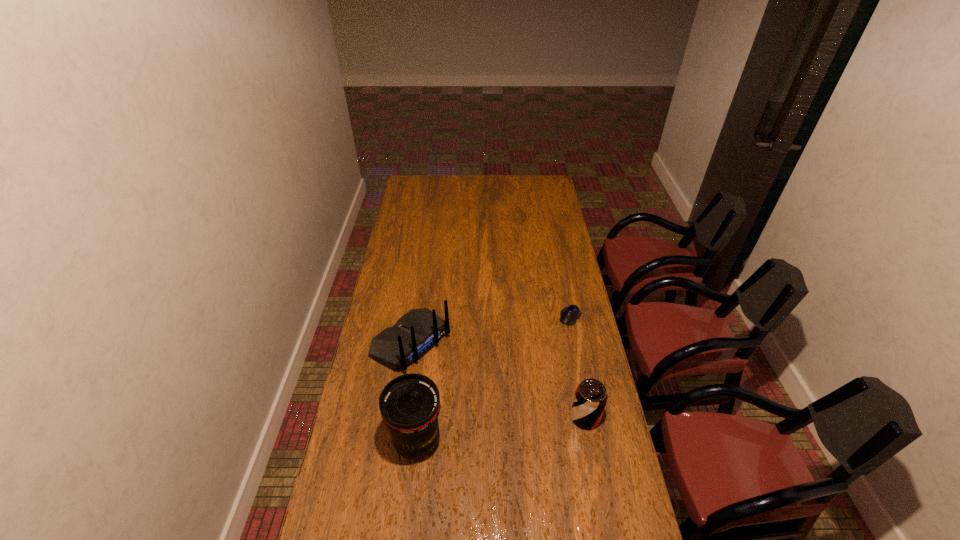
Identify the location of blank space at the far right corner of the desktop. This screenshot has height=540, width=960. (554, 193).

This screenshot has height=540, width=960. Identify the location of free space between the computer mouse and the router. (491, 329).

Image resolution: width=960 pixels, height=540 pixels. Find the location of `blank region between the shortest object and the soda can`. blank region between the shortest object and the soda can is located at coordinates (578, 367).

Identify the location of free space between the second shortest object and the second tallest object. (498, 380).

Identify the location of vacant area that lies between the third shortest object and the computer mouse. This screenshot has width=960, height=540. (491, 329).

This screenshot has height=540, width=960. Identify the location of empty location between the tallest object and the shortest object. (493, 379).

This screenshot has width=960, height=540. Identify the location of vacant space that is in between the shortest object and the soda can. (578, 367).

At what (x,y) coordinates should I click in order to perform the action: click on free space between the telephoto lens and the third tallest object. Please return your answer as a coordinate pair (x, y). The height and width of the screenshot is (540, 960). Looking at the image, I should click on (501, 429).

Find the location of a particular element. The width and height of the screenshot is (960, 540). the third closest object to the third tallest object is located at coordinates (414, 334).

Point out which object is positioned as the nearest to the soda can. Please provide its 2D coordinates. Your answer should be formatted as a tuple, i.e. [(x, y)], where the tuple contains the x and y coordinates of a point satisfying the conditions above.

[(569, 315)]